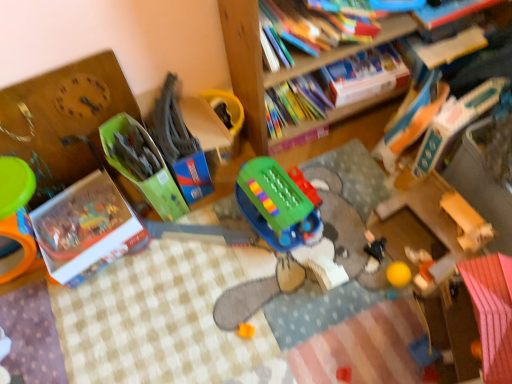
The height and width of the screenshot is (384, 512). What are the coordinates of `free point to the right of black plastic toy at center, positioned as the fifth toy in left-to-right order` in the screenshot? It's located at (406, 239).